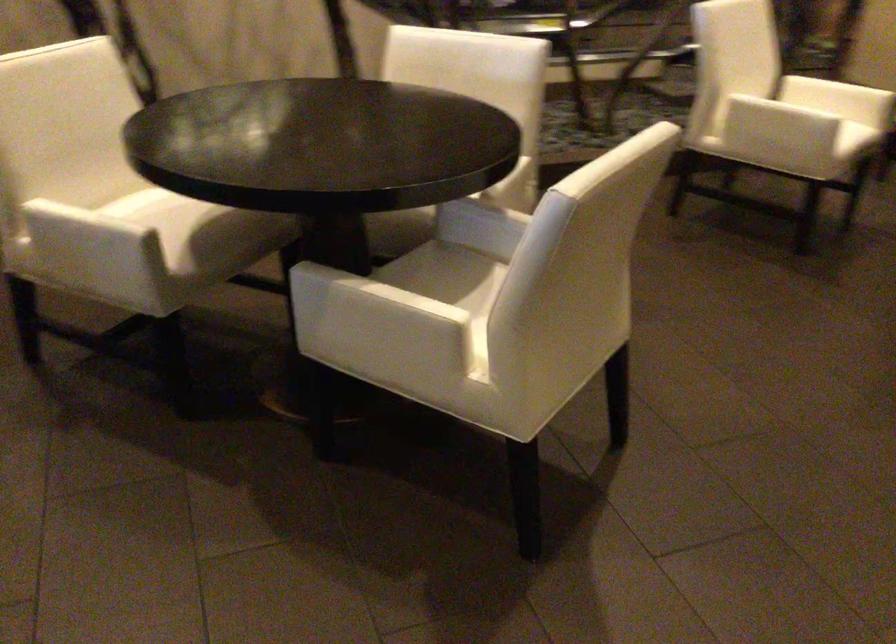
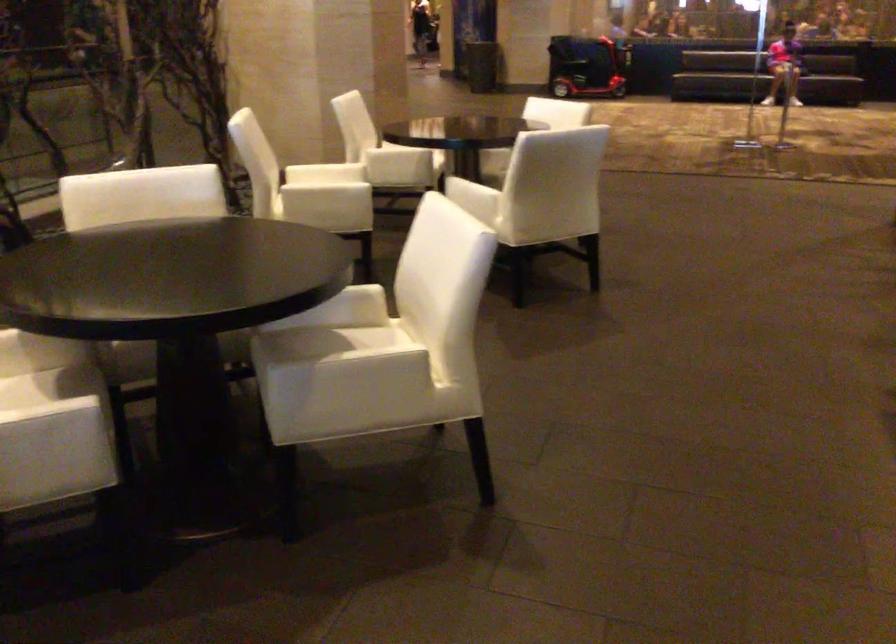
Find the pixel in the second image that matches point 469,270 in the first image.

(324, 339)